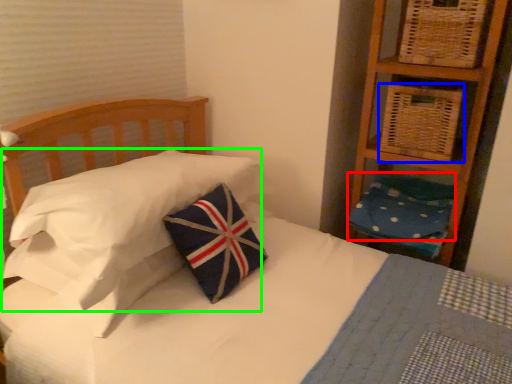
Question: Based on their relative distances, which object is farther from pillow (highlighted by a red box)? Choose from basket (highlighted by a blue box) and pillow (highlighted by a green box).

Choices:
 (A) basket
 (B) pillow

Answer: (B)